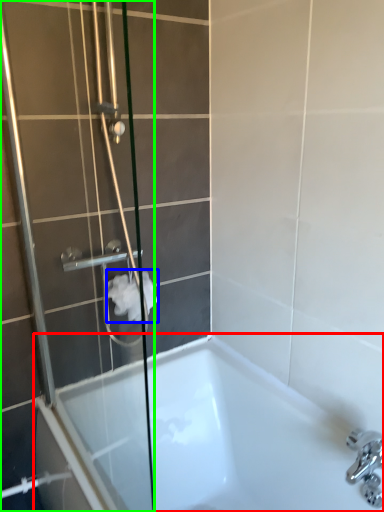
Question: Based on their relative distances, which object is farther from bathtub (highlighted by a red box)? Choose from toilet paper (highlighted by a blue box) and shower door (highlighted by a green box).

Choices:
 (A) toilet paper
 (B) shower door

Answer: (A)